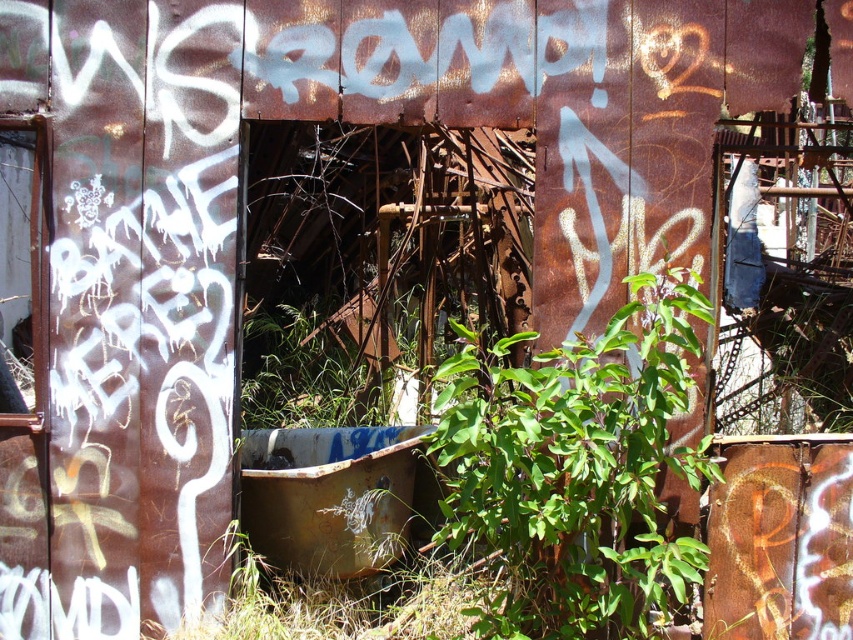
Does green leafy plant at center have a greater width compared to rusty metal tub at center?

Yes, green leafy plant at center is wider than rusty metal tub at center.

Is green leafy plant at center shorter than rusty metal tub at center?

Incorrect, green leafy plant at center's height does not fall short of rusty metal tub at center's.

Does point (646, 508) come farther from viewer compared to point (274, 547)?

No, it is not.

Identify the location of green leafy plant at center. (575, 470).